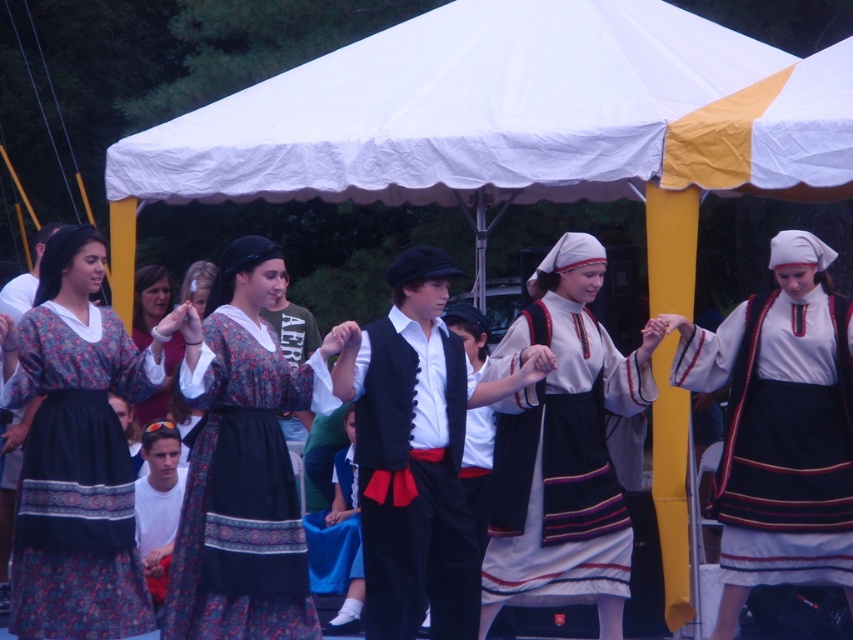
Measure the distance between matte floral dress at center and matte blue dress at center.

matte floral dress at center and matte blue dress at center are 13.50 feet apart from each other.

In the scene shown: Can you confirm if matte floral dress at center is positioned above matte blue dress at center?

Incorrect, matte floral dress at center is not positioned above matte blue dress at center.

Who is more forward, (227, 451) or (171, 362)?

Point (227, 451) is more forward.

The width and height of the screenshot is (853, 640). Find the location of `matte floral dress at center`. matte floral dress at center is located at coordinates (242, 464).

Which is behind, point (70, 234) or point (636, 380)?

The point (636, 380) is behind.

Can you confirm if printed fabric dress at center is thinner than matte white dress at center?

Yes.

Measure the distance between point (x=32, y=524) and camera.

The distance of point (x=32, y=524) from camera is 42.39 feet.

The width and height of the screenshot is (853, 640). In order to click on printed fabric dress at center in this screenshot , I will do `click(76, 451)`.

Is printed fabric dress at center positioned before matte blue dress at center?

Yes, it is in front of matte blue dress at center.

Between printed fabric dress at center and matte blue dress at center, which one has less height?

With less height is matte blue dress at center.

You are a GUI agent. You are given a task and a screenshot of the screen. Output one action in this format:
    pyautogui.click(x=<x>, y=<y>)
    Task: Click on the printed fabric dress at center
    
    Given the screenshot: What is the action you would take?
    pyautogui.click(x=76, y=451)